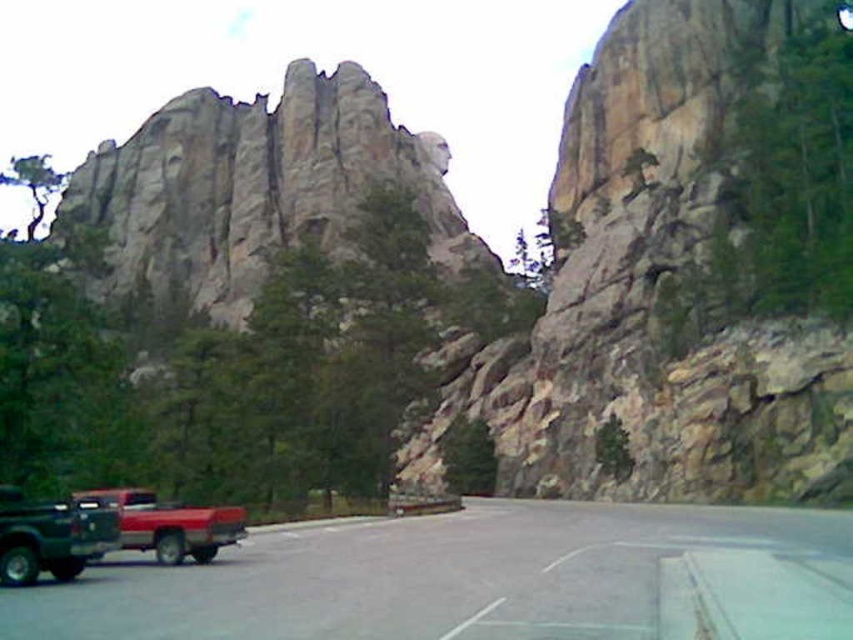
How distant is gray asphalt highway at center from brushed metal truck at lower left?

gray asphalt highway at center is 15.44 meters away from brushed metal truck at lower left.

Locate an element on the screen. gray asphalt highway at center is located at coordinates (479, 579).

Locate an element on the screen. gray asphalt highway at center is located at coordinates (479, 579).

Measure the distance between gray asphalt highway at center and camera.

gray asphalt highway at center and camera are 27.30 meters apart from each other.

Can you confirm if gray asphalt highway at center is positioned below matte red truck at lower left?

Indeed, gray asphalt highway at center is positioned under matte red truck at lower left.

Is point (265, 612) positioned behind point (160, 540)?

That is False.

Locate an element on the screen. gray asphalt highway at center is located at coordinates (479, 579).

Is point (3, 568) farther from camera compared to point (137, 486)?

No, it is in front of (137, 486).

Can you confirm if brushed metal truck at lower left is bigger than matte red truck at lower left?

Actually, brushed metal truck at lower left might be smaller than matte red truck at lower left.

Identify the location of brushed metal truck at lower left. (50, 536).